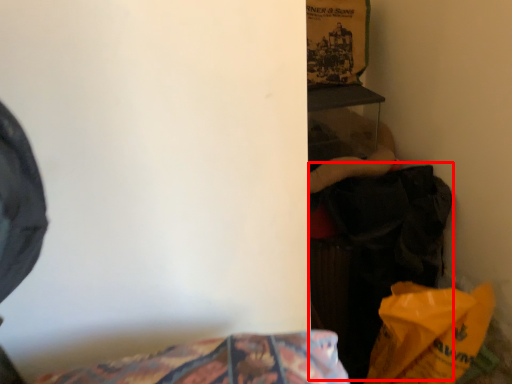
Question: From the image's perspective, considering the relative positions of clothing (annotated by the red box) and paper bag in the image provided, where is clothing (annotated by the red box) located with respect to the staircase?

Choices:
 (A) above
 (B) below

Answer: (A)